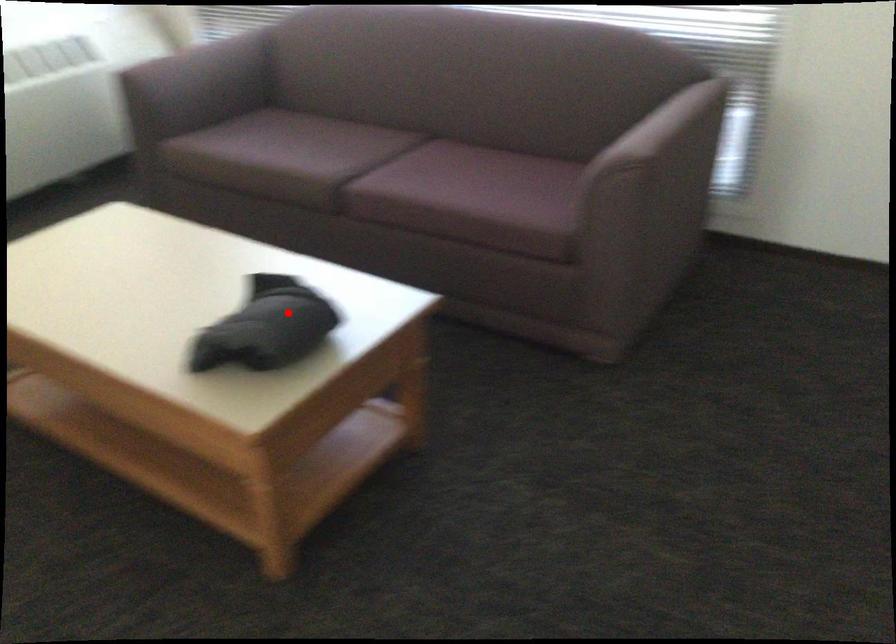
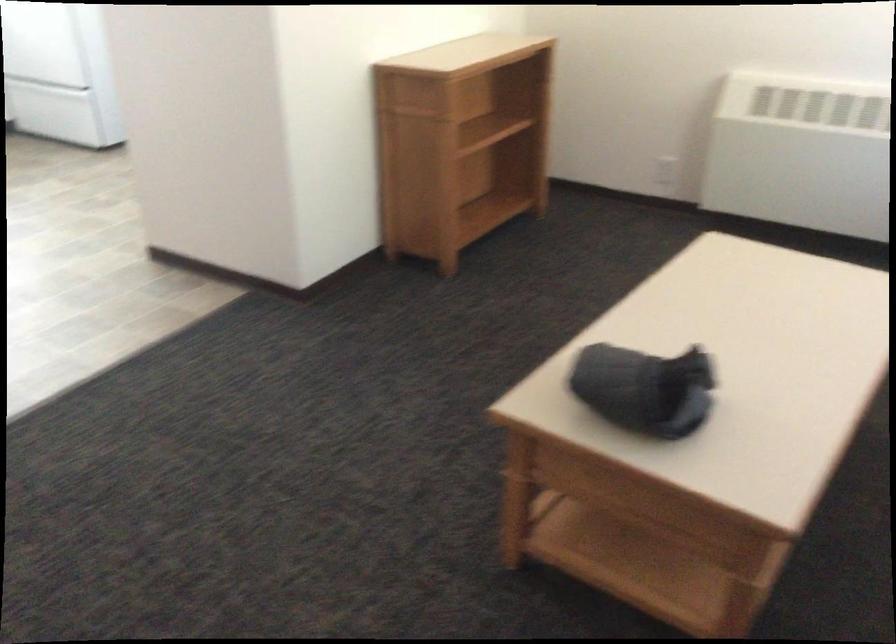
In the second image, find the point that corresponds to the highlighted location in the first image.

(644, 389)